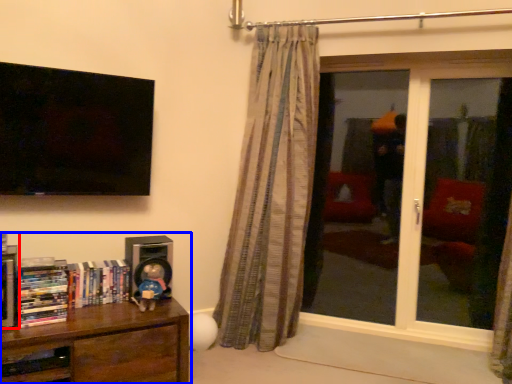
Question: Among these objects, which one is nearest to the camera, book (highlighted by a red box) or bookcase (highlighted by a blue box)?

Choices:
 (A) book
 (B) bookcase

Answer: (B)